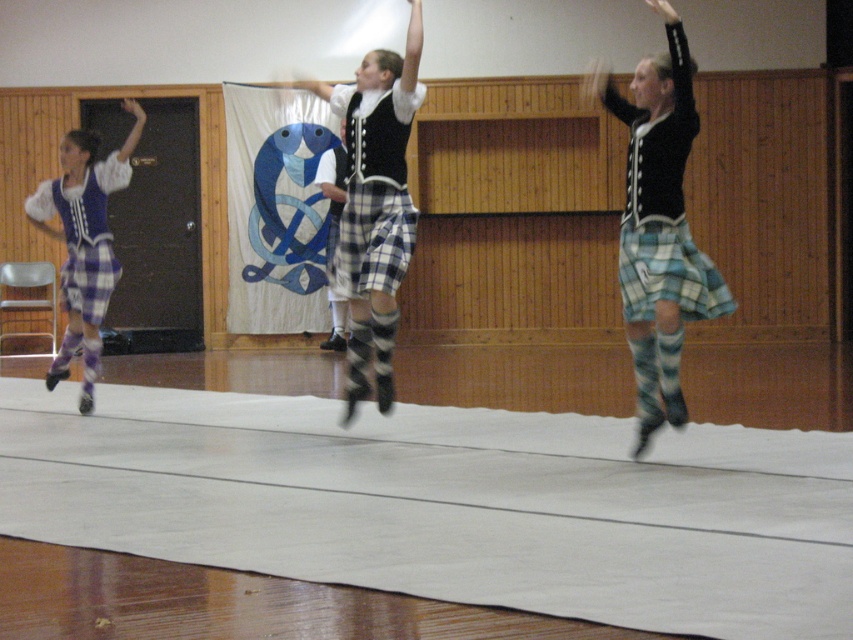
Question: Which point appears farthest from the camera in this image?

Choices:
 (A) (363, 289)
 (B) (685, 236)
 (C) (90, 307)
 (D) (94, 353)

Answer: (D)

Question: Which point is closer to the camera taking this photo?

Choices:
 (A) (349, 195)
 (B) (74, 307)
 (C) (650, 4)
 (D) (47, 380)

Answer: (C)

Question: Estimate the real-world distances between objects in this image. Which object is closer to the plaid fabric skirt at left?

Choices:
 (A) plaid fabric kilt at left
 (B) plaid fabric kilt at center
 (C) plaid skirt at center

Answer: (A)

Question: Can you confirm if plaid fabric kilt at center is thinner than plaid fabric kilt at left?

Choices:
 (A) yes
 (B) no

Answer: (A)

Question: Does plaid fabric skirt at left have a greater width compared to plaid fabric kilt at left?

Choices:
 (A) no
 (B) yes

Answer: (B)

Question: Is blue plaid kilt at right further to the viewer compared to plaid fabric kilt at center?

Choices:
 (A) yes
 (B) no

Answer: (B)